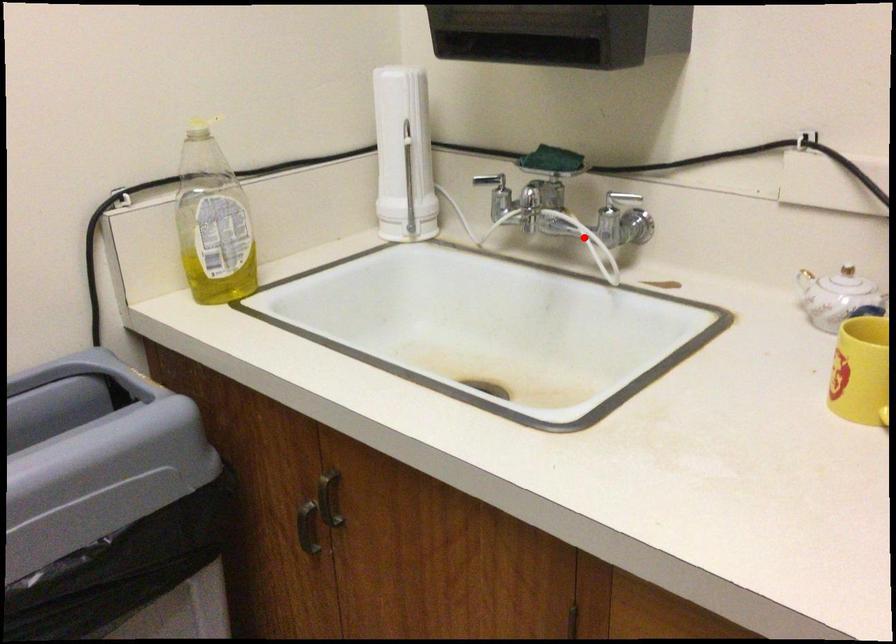
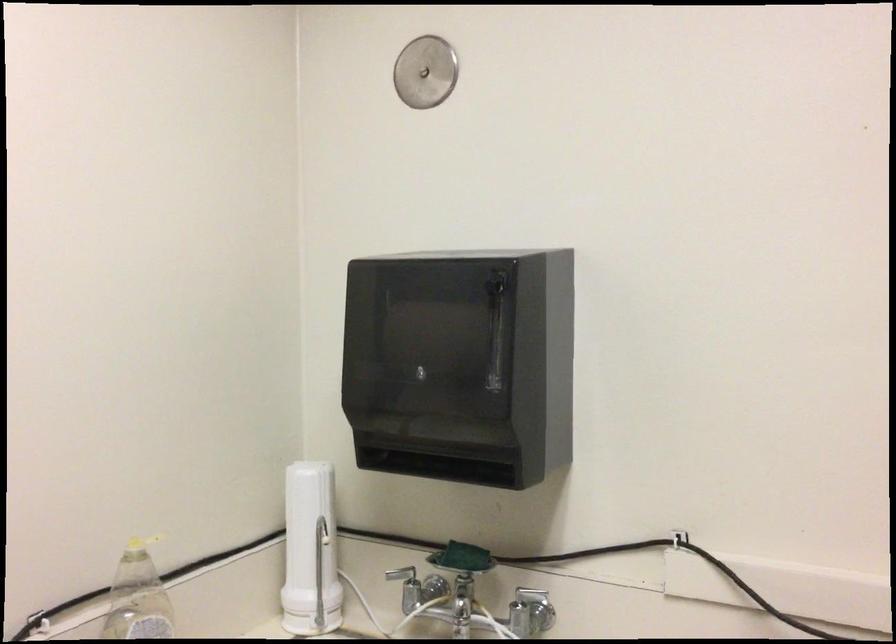
Find the pixel in the second image that matches the highlighted location in the first image.

(490, 621)